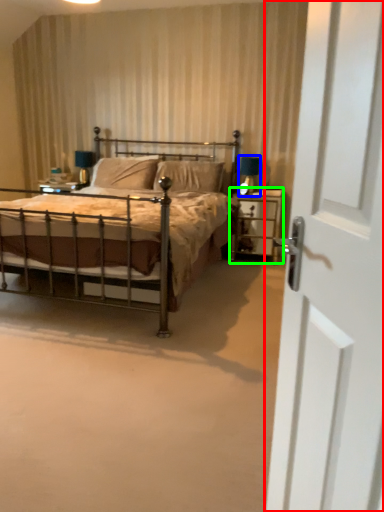
Question: Which object is positioned farthest from door (highlighted by a red box)? Select from table lamp (highlighted by a blue box) and nightstand (highlighted by a green box).

Choices:
 (A) table lamp
 (B) nightstand

Answer: (A)